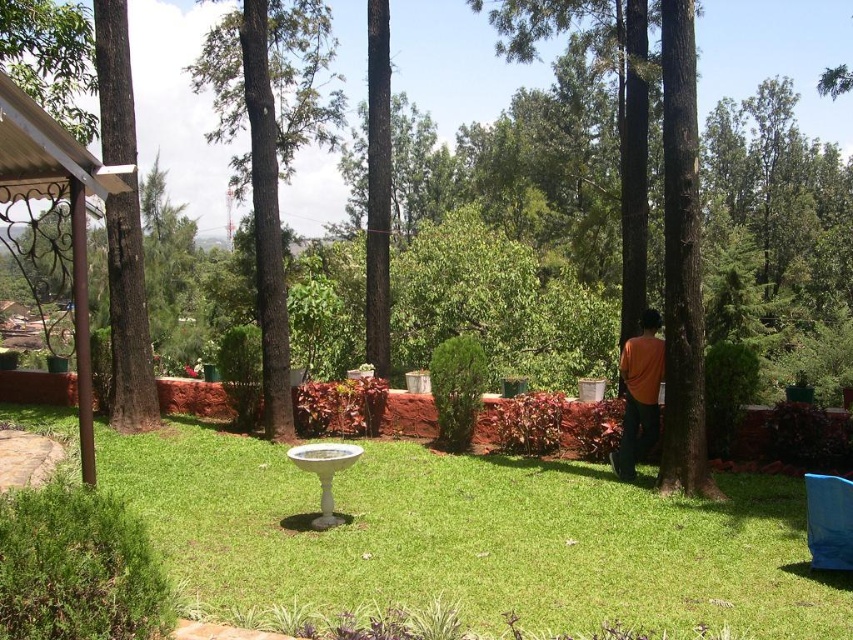
You are standing in the garden and want to walk from the brown rough tree at left to the green grass at center. Which direction should you move?

You should move to the right because the green grass at center is located to the right of the brown rough tree at left.

You are standing in the garden looking at the green grass at center and the brown rough tree at left. Which object is closer to you?

The green grass at center is closer to you because it is in front of the brown rough tree at left.